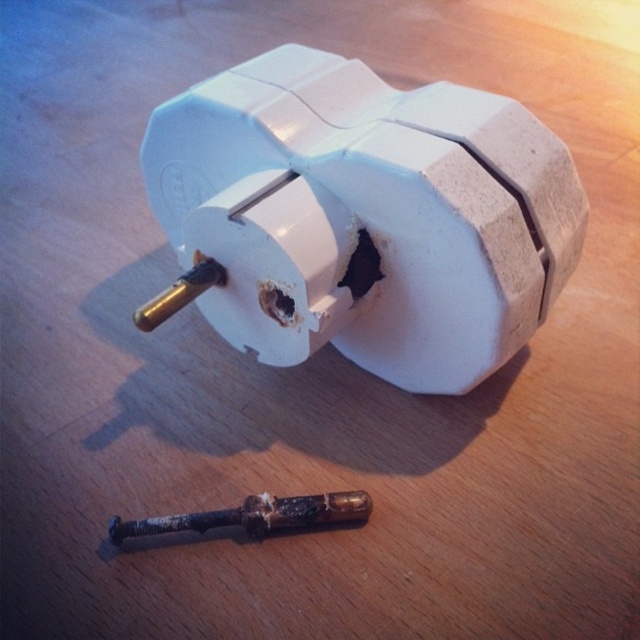
You are a repair technician assessing the scene. You see the white plastic plug at center and the rusty metallic screwdriver at lower center. Which object is located above the other?

The white plastic plug at center is positioned over the rusty metallic screwdriver at lower center, meaning it is above the screwdriver.